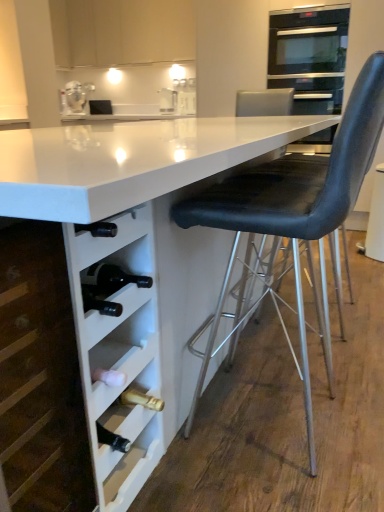
Image resolution: width=384 pixels, height=512 pixels. What do you see at coordinates (295, 202) in the screenshot?
I see `black leather chair at right` at bounding box center [295, 202].

Find the location of a particular element. white matte wine rack at lower left, which is the 2th cabinetry from back to front is located at coordinates pos(40,376).

Describe the element at coordinates (309, 56) in the screenshot. I see `stainless steel oven at upper right` at that location.

Locate an element on the screen. This screenshot has width=384, height=512. black leather swivel chair at right is located at coordinates (264, 102).

You are a GUI agent. You are given a task and a screenshot of the screen. Output one action in this format:
    pyautogui.click(x=<x>, y=<y>)
    Task: Click on the home appliance that appears below the white matte cabinet at upper center, placed as the 1th cabinetry when sorted from back to front (from a real-world perspective)
    This screenshot has height=512, width=384.
    Given the screenshot: What is the action you would take?
    pyautogui.click(x=309, y=56)

Is white matte cabinet at upper center, placed as the 1th cabinetry when sorted from back to front, turned away from stainless steel oven at upper right?

No, white matte cabinet at upper center, placed as the 1th cabinetry when sorted from back to front, is not facing the opposite direction of stainless steel oven at upper right.

Is white matte cabinet at upper center, the 1th cabinetry viewed from the top, completely or partially outside of stainless steel oven at upper right?

That's correct, white matte cabinet at upper center, the 1th cabinetry viewed from the top, is outside of stainless steel oven at upper right.

From the image's perspective, would you say white matte wine rack at lower left, which is the 2th cabinetry from back to front, is positioned over white matte cabinet at upper center, acting as the second cabinetry starting from the bottom?

No, from the image's perspective, white matte wine rack at lower left, which is the 2th cabinetry from back to front, is not over white matte cabinet at upper center, acting as the second cabinetry starting from the bottom.

Is white matte wine rack at lower left, which is the 2th cabinetry from back to front, to the left or to the right of white matte cabinet at upper center, which is the second cabinetry in front-to-back order, in the image?

white matte wine rack at lower left, which is the 2th cabinetry from back to front, is positioned on white matte cabinet at upper center, which is the second cabinetry in front-to-back order,'s right side.

Considering the relative sizes of white matte wine rack at lower left, the second cabinetry positioned from the top, and white matte cabinet at upper center, which is the second cabinetry in front-to-back order, in the image provided, is white matte wine rack at lower left, the second cabinetry positioned from the top, bigger than white matte cabinet at upper center, which is the second cabinetry in front-to-back order,?

No, white matte wine rack at lower left, the second cabinetry positioned from the top, is not bigger than white matte cabinet at upper center, which is the second cabinetry in front-to-back order.

Between white matte wine rack at lower left, which is the 2th cabinetry from back to front, and white matte cabinet at upper center, acting as the second cabinetry starting from the bottom, which one is positioned behind?

white matte cabinet at upper center, acting as the second cabinetry starting from the bottom, is more distant.

Is black leather chair at right oriented away from black leather swivel chair at right?

That's not correct — black leather chair at right is not looking away from black leather swivel chair at right.

How much distance is there between black leather chair at right and black leather swivel chair at right?

black leather chair at right is 1.54 meters away from black leather swivel chair at right.

Is black leather chair at right positioned far away from black leather swivel chair at right?

Yes, black leather chair at right is far from black leather swivel chair at right.

Considering the sizes of objects black leather chair at right and black leather swivel chair at right in the image provided, who is taller, black leather chair at right or black leather swivel chair at right?

black leather chair at right.

In the scene shown: Is clear glass jar at upper left oriented towards white matte wine rack at lower left, placed as the 1th cabinetry when sorted from front to back?

No, clear glass jar at upper left is not turned towards white matte wine rack at lower left, placed as the 1th cabinetry when sorted from front to back.

Looking at this image, in the image, is clear glass jar at upper left positioned in front of or behind white matte wine rack at lower left, the first cabinetry when ordered from bottom to top?

Clearly, clear glass jar at upper left is behind white matte wine rack at lower left, the first cabinetry when ordered from bottom to top.

Considering the sizes of objects clear glass jar at upper left and white matte wine rack at lower left, the second cabinetry positioned from the top, in the image provided, who is taller, clear glass jar at upper left or white matte wine rack at lower left, the second cabinetry positioned from the top,?

With more height is white matte wine rack at lower left, the second cabinetry positioned from the top.

Is clear glass jar at upper left inside the boundaries of black leather chair at right, or outside?

The correct answer is: outside.

From the image's perspective, between clear glass jar at upper left and black leather chair at right, who is located below?

black leather chair at right, from the image's perspective.

Looking at this image, what's the angular difference between clear glass jar at upper left and black leather chair at right's facing directions?

The angular difference between clear glass jar at upper left and black leather chair at right is 149 degrees.

From the image's perspective, would you say black leather swivel chair at right is shown under white glossy table at center?

Incorrect, from the image's perspective, black leather swivel chair at right is higher than white glossy table at center.

Is there a large distance between black leather swivel chair at right and white glossy table at center?

Yes, black leather swivel chair at right is far from white glossy table at center.

Is black leather swivel chair at right thinner than white glossy table at center?

Yes, black leather swivel chair at right is thinner than white glossy table at center.

Which object is more forward, black leather swivel chair at right or white glossy table at center?

white glossy table at center.

Where is `swivel chair on the right side of white matte wine rack at lower left, placed as the 1th cabinetry when sorted from front to back`? The image size is (384, 512). swivel chair on the right side of white matte wine rack at lower left, placed as the 1th cabinetry when sorted from front to back is located at coordinates (264, 102).

Which of these two, white matte wine rack at lower left, the first cabinetry when ordered from bottom to top, or black leather swivel chair at right, is bigger?

black leather swivel chair at right.

From a real-world perspective, between white matte wine rack at lower left, which is the 2th cabinetry from back to front, and black leather swivel chair at right, who is vertically lower?

From a 3D spatial view, white matte wine rack at lower left, which is the 2th cabinetry from back to front, is below.

I want to click on home appliance that is under the white matte cabinet at upper center, which is the second cabinetry in front-to-back order (from a real-world perspective), so click(x=309, y=56).

At what (x,y) coordinates should I click in order to perform the action: click on cabinetry that is on the left side of white matte wine rack at lower left, the first cabinetry when ordered from bottom to top. Please return your answer as a coordinate pair (x, y). This screenshot has height=512, width=384. Looking at the image, I should click on (128, 32).

In the scene shown: Which object lies nearer to the anchor point black leather swivel chair at right, white matte wine rack at lower left, the first cabinetry when ordered from bottom to top, or white matte cabinet at upper center, acting as the second cabinetry starting from the bottom?

The object closer to black leather swivel chair at right is white matte cabinet at upper center, acting as the second cabinetry starting from the bottom.

Considering their positions, is black leather swivel chair at right positioned closer to stainless steel oven at upper right than white matte cabinet at upper center, which is the second cabinetry in front-to-back order?

black leather swivel chair at right is positioned closer to the anchor stainless steel oven at upper right.

Looking at the image, which one is located closer to white matte wine rack at lower left, the first cabinetry when ordered from bottom to top, black leather chair at right or stainless steel oven at upper right?

black leather chair at right is positioned closer to the anchor white matte wine rack at lower left, the first cabinetry when ordered from bottom to top.

Based on their spatial positions, is white matte wine rack at lower left, the first cabinetry when ordered from bottom to top, or black leather chair at right closer to black leather swivel chair at right?

black leather chair at right.

Considering their positions, is white glossy table at center positioned further to stainless steel oven at upper right than white matte cabinet at upper center, placed as the 1th cabinetry when sorted from back to front?

The object further to stainless steel oven at upper right is white glossy table at center.

Estimate the real-world distances between objects in this image. Which object is further from stainless steel oven at upper right, black leather chair at right or black leather swivel chair at right?

black leather chair at right is positioned further to the anchor stainless steel oven at upper right.

From the image, which object appears to be farther from white matte wine rack at lower left, the first cabinetry when ordered from bottom to top, white glossy table at center or clear glass jar at upper left?

Among the two, clear glass jar at upper left is located further to white matte wine rack at lower left, the first cabinetry when ordered from bottom to top.

From the image, which object appears to be farther from clear glass jar at upper left, stainless steel oven at upper right or white matte cabinet at upper center, acting as the second cabinetry starting from the bottom?

The object further to clear glass jar at upper left is stainless steel oven at upper right.

Find the location of `swivel chair between black leather chair at right and stainless steel oven at upper right in the front-back direction`. swivel chair between black leather chair at right and stainless steel oven at upper right in the front-back direction is located at coordinates (264, 102).

Where is `chair between white matte wine rack at lower left, which is the 2th cabinetry from back to front, and stainless steel oven at upper right in the front-back direction`? This screenshot has height=512, width=384. chair between white matte wine rack at lower left, which is the 2th cabinetry from back to front, and stainless steel oven at upper right in the front-back direction is located at coordinates (295, 202).

This screenshot has width=384, height=512. I want to click on cabinetry between white glossy table at center and white matte cabinet at upper center, the 1th cabinetry viewed from the top, in the front-back direction, so click(40, 376).

In order to click on cabinetry between white glossy table at center and black leather swivel chair at right along the z-axis in this screenshot , I will do `click(40, 376)`.